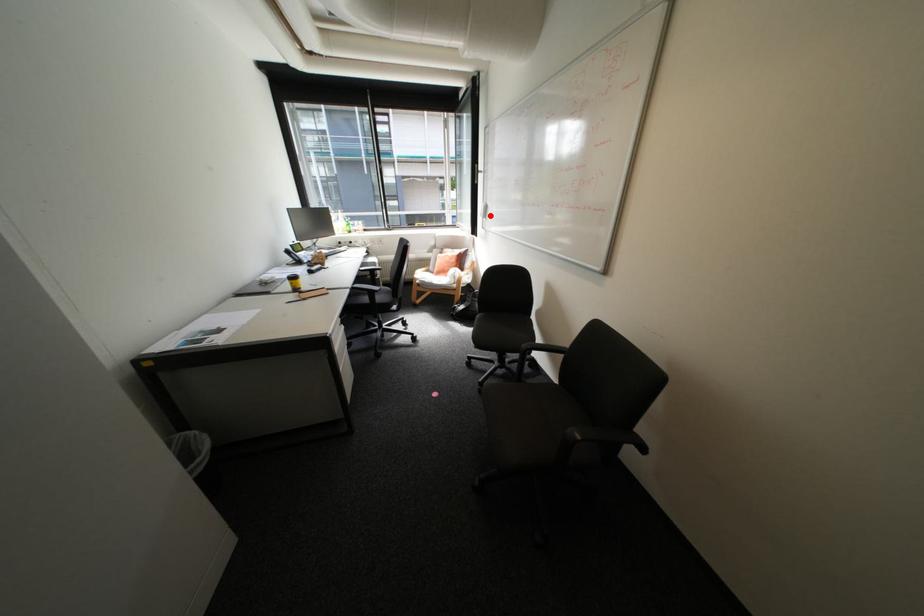
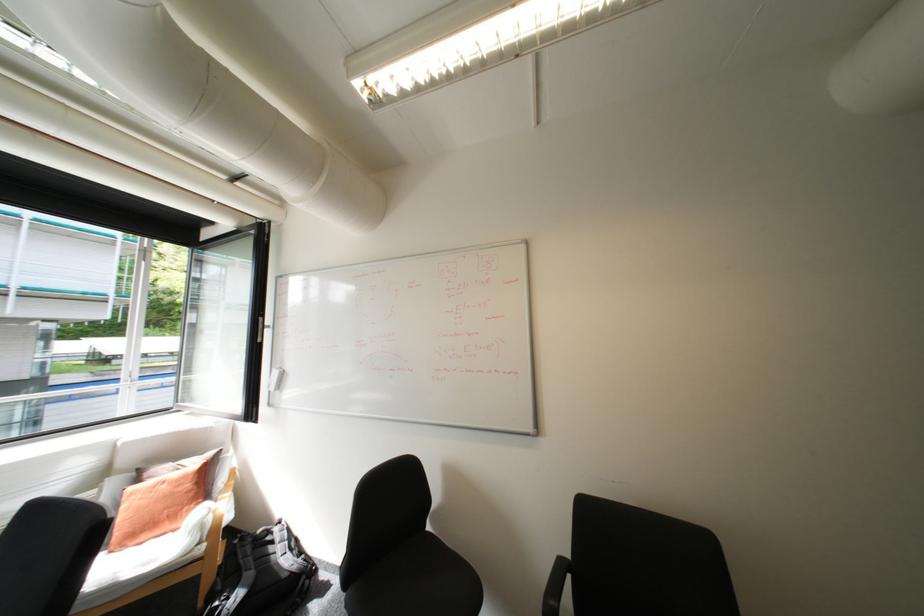
The point at the highlighted location is marked in the first image. Where is the corresponding point in the second image?

(277, 387)